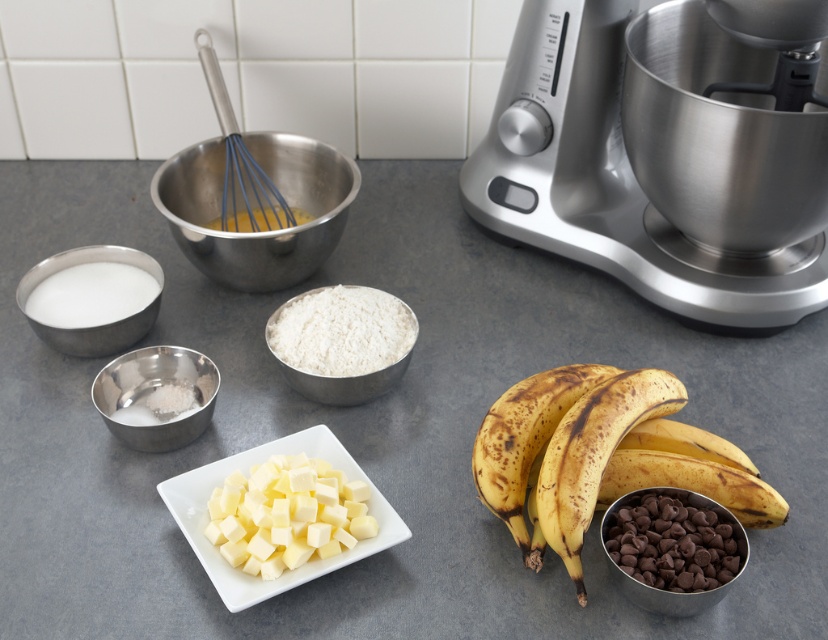
Question: Is white creamy butter at center wider than white powder at center?

Choices:
 (A) yes
 (B) no

Answer: (B)

Question: Estimate the real-world distances between objects in this image. Which object is closer to the white creamy butter at center?

Choices:
 (A) metal whisk at center
 (B) blue rubber whisk at center

Answer: (B)

Question: Which is farther from the white creamy butter at center?

Choices:
 (A) silver metallic bowl at center left
 (B) brown spotted bananas at lower right
 (C) metal whisk at center
 (D) brown matte bananas at center right

Answer: (C)

Question: From the image, what is the correct spatial relationship of silver metallic mixer at upper right in relation to blue rubber whisk at center?

Choices:
 (A) below
 (B) above

Answer: (A)

Question: Estimate the real-world distances between objects in this image. Which object is farther from the brown spotted bananas at lower right?

Choices:
 (A) white creamy butter at center
 (B) silver metallic mixer at upper right
 (C) metal whisk at center

Answer: (C)

Question: Does brown matte bananas at center right have a greater width compared to blue rubber whisk at center?

Choices:
 (A) yes
 (B) no

Answer: (A)